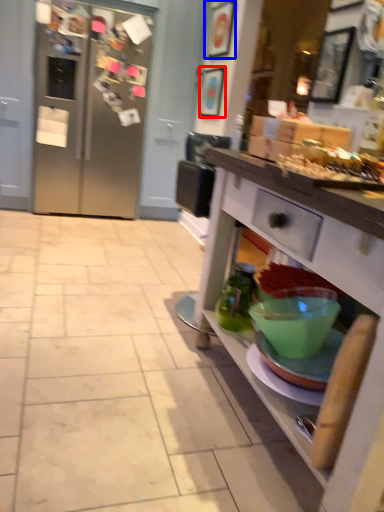
Question: Which point is further to the camera, picture frame (highlighted by a red box) or picture frame (highlighted by a blue box)?

Choices:
 (A) picture frame
 (B) picture frame

Answer: (A)